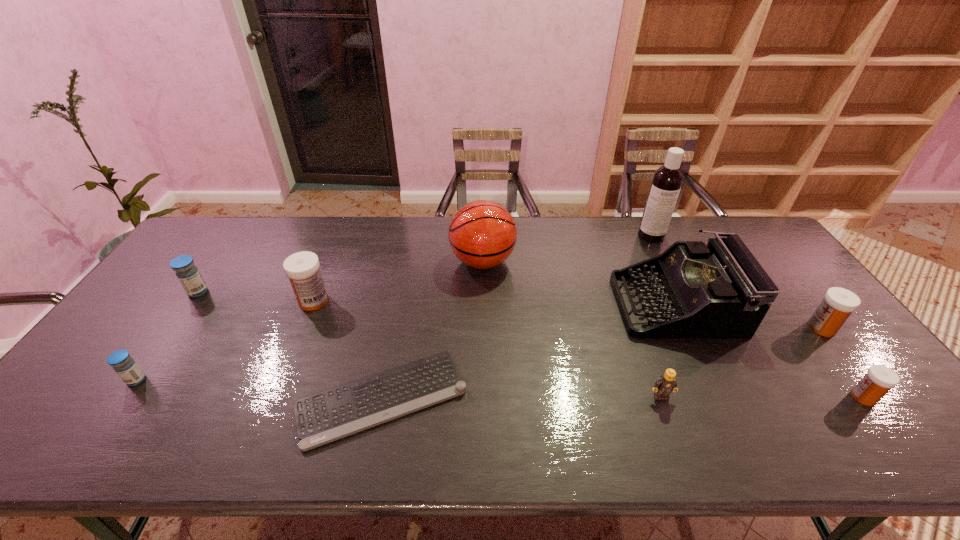
Identify the location of vacant space that satisfies the following two spatial constraints: 1. in front of the smallest white medicine; 2. on the left side of the tan Lego. pos(661,397).

Locate an element on the screen. This screenshot has width=960, height=540. blank area in the image that satisfies the following two spatial constraints: 1. on the back side of the second smallest white medicine; 2. on the side with spill of the ninth shortest object is located at coordinates (770, 261).

Find the location of a particular element. The width and height of the screenshot is (960, 540). free space that satisfies the following two spatial constraints: 1. on the side with spill of the ninth shortest object; 2. on the right side of the smallest white medicine is located at coordinates (484, 397).

The height and width of the screenshot is (540, 960). Identify the location of vacant space that satisfies the following two spatial constraints: 1. on the label side of the tallest object; 2. on the left side of the nearest white medicine. (732, 397).

I want to click on free location that satisfies the following two spatial constraints: 1. on the typing side of the black typewriter; 2. in front of the tan Lego, so click(719, 396).